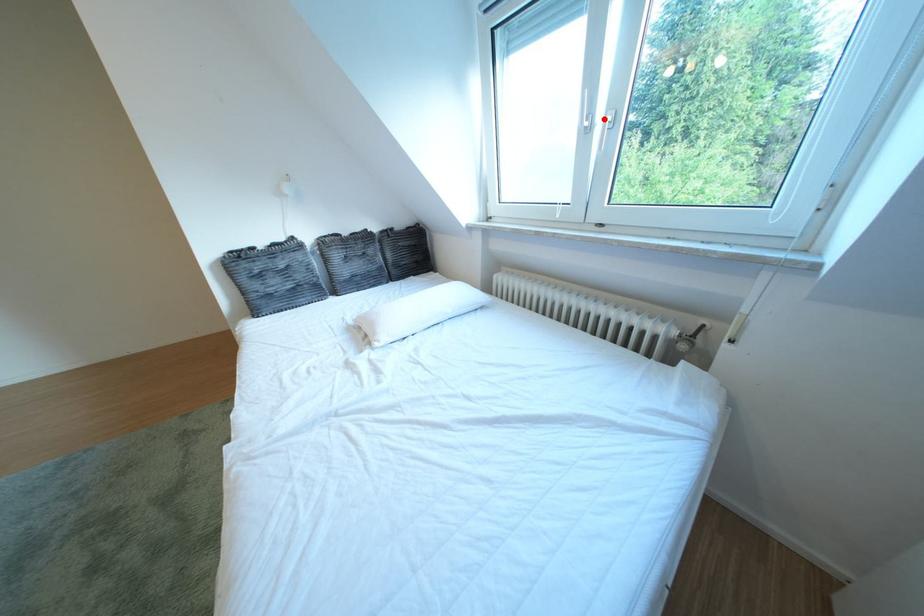
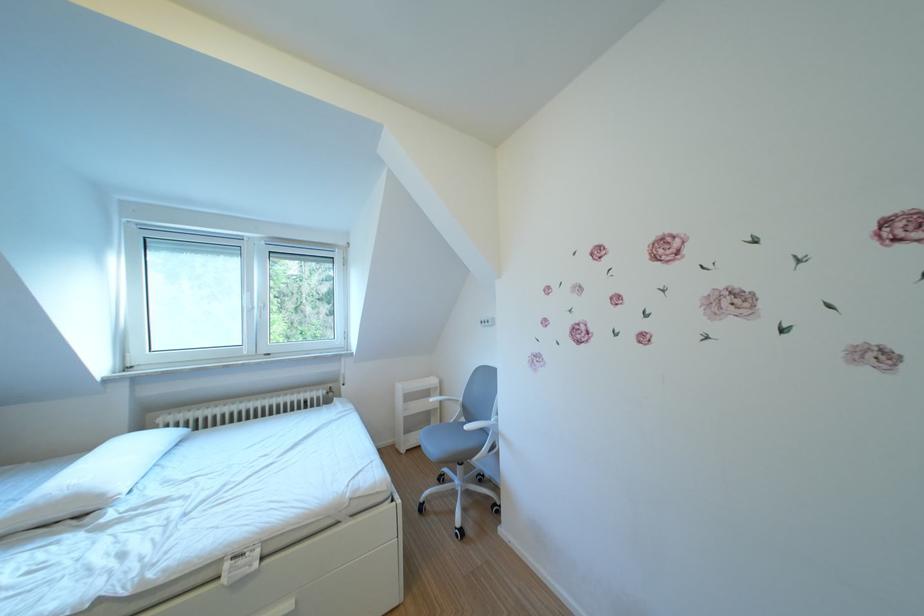
Locate, in the second image, the point that corresponds to the highlighted location in the first image.

(265, 307)